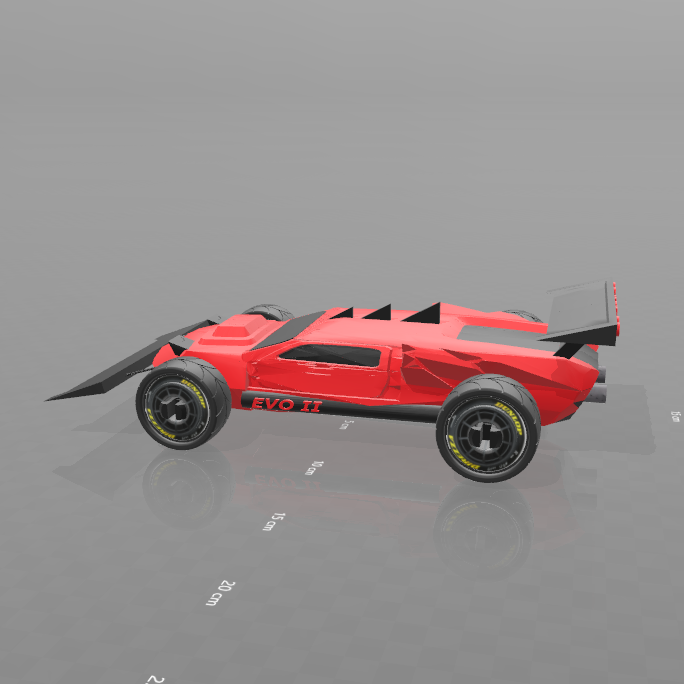
Image resolution: width=684 pixels, height=684 pixels. In order to click on left door in this screenshot , I will do `click(285, 371)`.